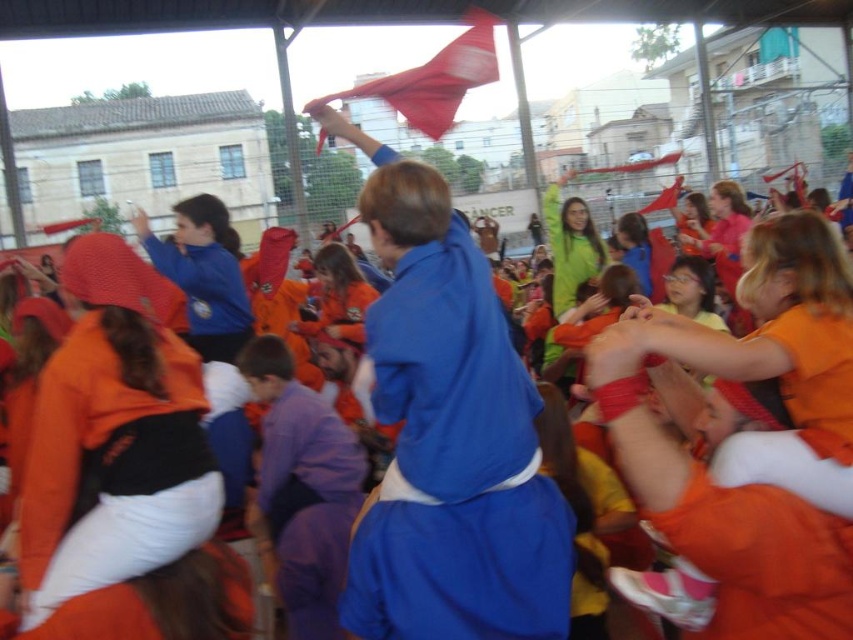
You are a photographer standing in the middle of the scene. You want to take a photo that includes both the blue cotton robe at center and the silky red flag at upper center. Which object will appear larger in your photo?

The blue cotton robe at center will appear larger in the photo because it is closer to the viewer than the silky red flag at upper center.

You are organizing a parade and need to decide which item to place first in the procession. The orange fleece robe at lower left and the red fabric flag at upper center are both part of the decorations. Considering their sizes, which one should be placed first if you want the thinner item to lead the parade?

The orange fleece robe at lower left is thinner than the red fabric flag at upper center, so it should be placed first in the procession to lead the parade.

You are standing in the middle of the outdoor event area and see two points marked in the image. Which point, point (469,531) or point (22,579), is closer to you?

Point (469,531) is closer to you because it is further to the viewer than point (22,579).